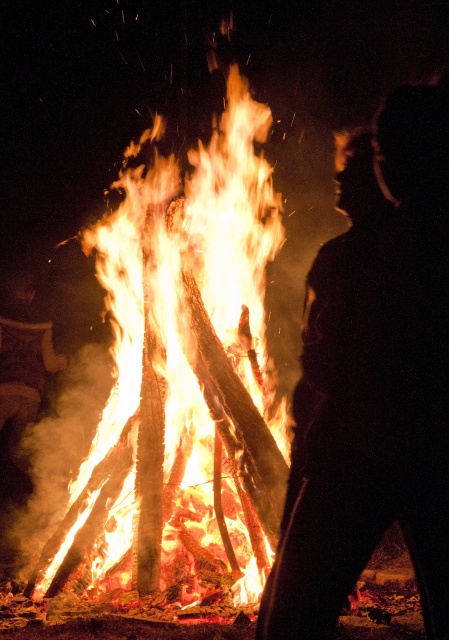
Question: Considering the relative positions of silhouette figure at center and bright orange wood at center in the image provided, where is silhouette figure at center located with respect to bright orange wood at center?

Choices:
 (A) below
 (B) above

Answer: (A)

Question: Which object appears closest to the camera in this image?

Choices:
 (A) silhouette figure at center
 (B) bright orange wood at center

Answer: (A)

Question: Is silhouette figure at center bigger than bright orange wood at center?

Choices:
 (A) no
 (B) yes

Answer: (A)

Question: Can you confirm if silhouette figure at center is smaller than bright orange wood at center?

Choices:
 (A) yes
 (B) no

Answer: (A)

Question: Which object appears closest to the camera in this image?

Choices:
 (A) silhouette figure at center
 (B) bright orange wood at center

Answer: (A)